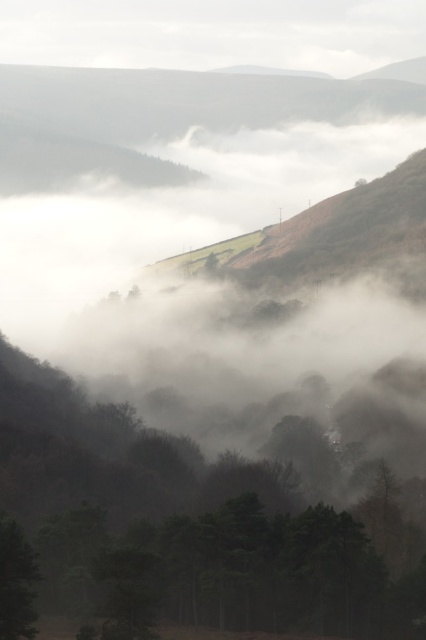
Question: Is green matte tree at center thinner than green matte tree at lower left?

Choices:
 (A) yes
 (B) no

Answer: (B)

Question: Can you confirm if green matte tree at center is bigger than green matte tree at lower left?

Choices:
 (A) yes
 (B) no

Answer: (A)

Question: Is the position of green matte tree at center less distant than that of green matte tree at lower left?

Choices:
 (A) no
 (B) yes

Answer: (A)

Question: Among these objects, which one is farthest from the camera?

Choices:
 (A) green matte tree at lower left
 (B) green matte tree at center

Answer: (B)

Question: Which point is farther to the camera?

Choices:
 (A) pyautogui.click(x=396, y=592)
 (B) pyautogui.click(x=6, y=589)

Answer: (A)